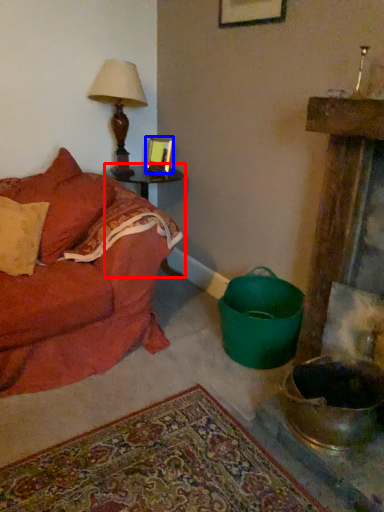
Question: Which object appears closest to the camera in this image, table (highlighted by a red box) or picture frame (highlighted by a blue box)?

Choices:
 (A) table
 (B) picture frame

Answer: (A)